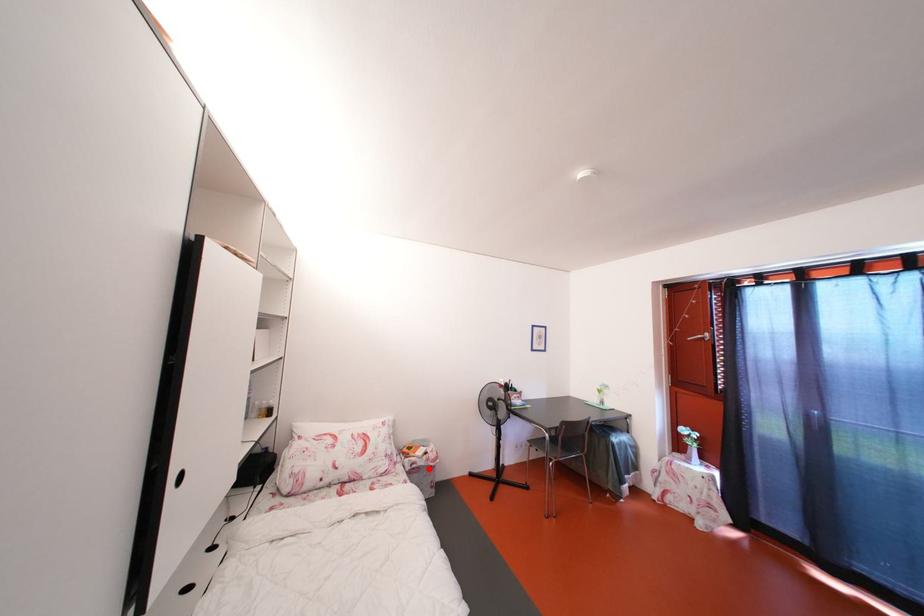
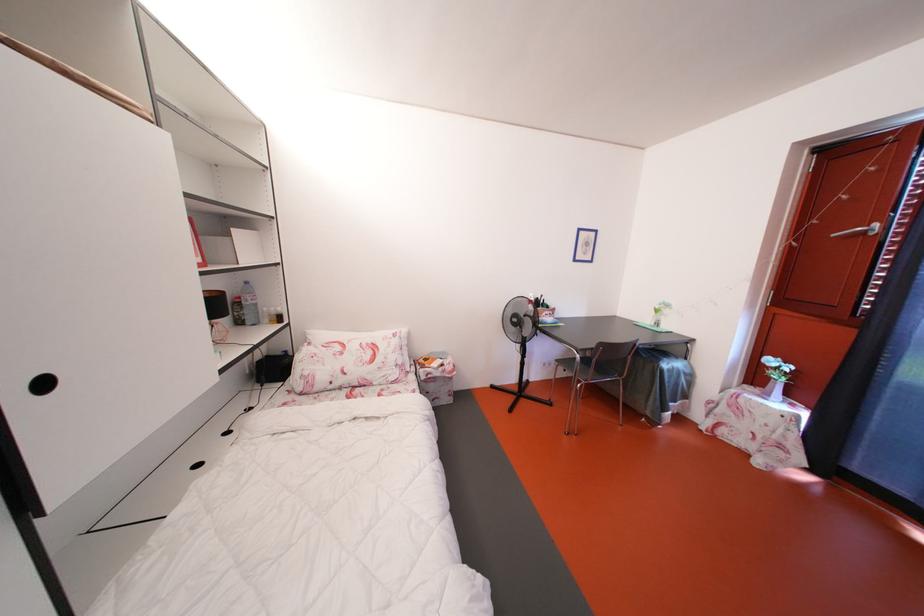
In the second image, find the point that corresponds to the highlighted location in the first image.

(444, 379)